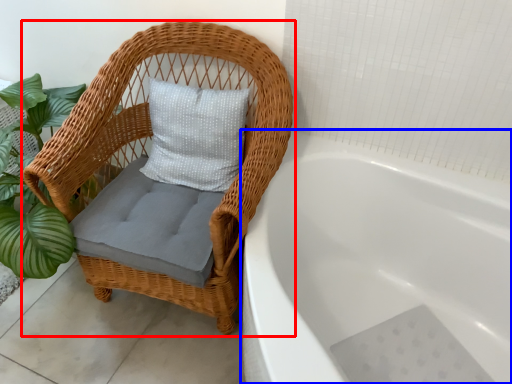
Question: Which object appears closest to the camera in this image, chair (highlighted by a red box) or bathtub (highlighted by a blue box)?

Choices:
 (A) chair
 (B) bathtub

Answer: (B)